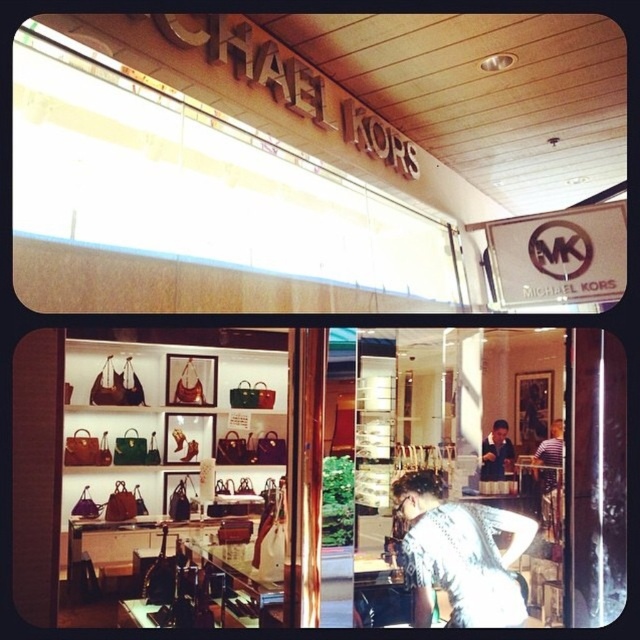
Image resolution: width=640 pixels, height=640 pixels. Describe the element at coordinates (456, 477) in the screenshot. I see `matte black handbags at center` at that location.

Between point (467, 540) and point (506, 444), which one is positioned behind?

Positioned behind is point (506, 444).

The image size is (640, 640). What are the coordinates of `matte black handbags at center` in the screenshot? It's located at (456, 477).

Is white lace dress at center thinner than striped shirt at center?

Incorrect, white lace dress at center's width is not less than striped shirt at center's.

Is white lace dress at center in front of striped shirt at center?

Yes, white lace dress at center is closer to the viewer.

The height and width of the screenshot is (640, 640). What do you see at coordinates (460, 554) in the screenshot?
I see `white lace dress at center` at bounding box center [460, 554].

This screenshot has width=640, height=640. Find the location of `white lace dress at center`. white lace dress at center is located at coordinates (460, 554).

Can you confirm if matte black handbags at center is smaller than shiny leather handbags at center?

Yes.

Does matte black handbags at center have a lesser width compared to shiny leather handbags at center?

Correct, matte black handbags at center's width is less than shiny leather handbags at center's.

Does point (397, 476) come closer to viewer compared to point (109, 380)?

That is True.

Where is `matte black handbags at center`? This screenshot has width=640, height=640. matte black handbags at center is located at coordinates (456, 477).